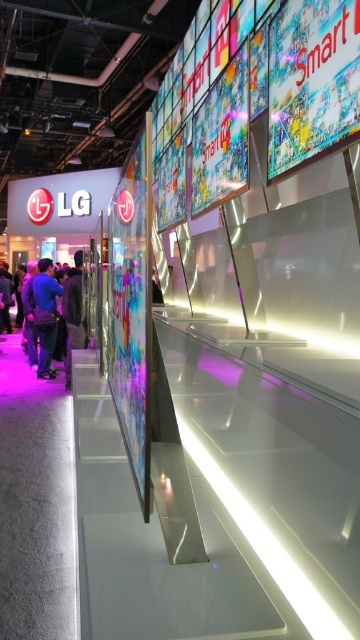
Question: Observing the image, what is the correct spatial positioning of dark blue shirt at center in reference to blue fabric shirt at left?

Choices:
 (A) above
 (B) below

Answer: (B)

Question: Which point is closer to the camera?

Choices:
 (A) dark blue shirt at center
 (B) dark gray jacket at left

Answer: (B)

Question: Can you confirm if blue fabric shirt at left is thinner than dark gray jacket at left?

Choices:
 (A) no
 (B) yes

Answer: (A)

Question: Which object is the closest to the blue fabric shirt at left?

Choices:
 (A) dark blue shirt at center
 (B) dark gray jacket at left

Answer: (A)

Question: Can you confirm if dark blue shirt at center is positioned to the right of blue fabric shirt at left?

Choices:
 (A) yes
 (B) no

Answer: (A)

Question: Which point is farther to the camera?

Choices:
 (A) (46, 260)
 (B) (79, 288)

Answer: (A)